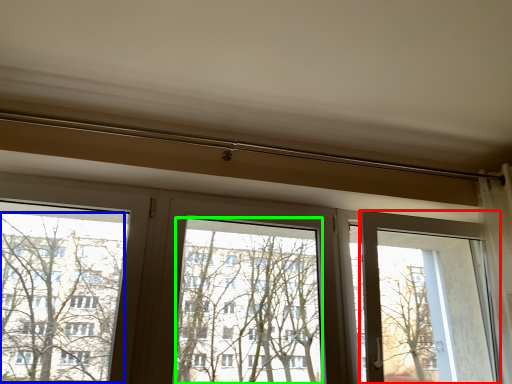
Question: Estimate the real-world distances between objects in this image. Which object is closer to screen door (highlighted by a red box), tree (highlighted by a blue box) or window screen (highlighted by a green box)?

Choices:
 (A) tree
 (B) window screen

Answer: (B)